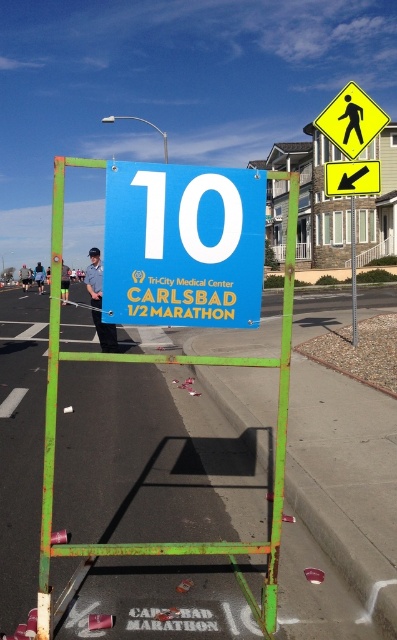
Question: Is smooth asphalt road at center bigger than green metal pole at center?

Choices:
 (A) yes
 (B) no

Answer: (B)

Question: Which object is closer to the camera taking this photo?

Choices:
 (A) smooth asphalt road at center
 (B) yellow plastic pedestrian crossing sign at upper right
 (C) yellow diamond pedestrian sign at upper right

Answer: (A)

Question: Which object appears farthest from the camera in this image?

Choices:
 (A) smooth asphalt road at center
 (B) blue matte sign at center
 (C) yellow diamond pedestrian sign at upper right
 (D) concrete at lower center

Answer: (C)

Question: Is blue matte sign at center above green metal pole at center?

Choices:
 (A) yes
 (B) no

Answer: (B)

Question: Which point is closer to the camera?

Choices:
 (A) concrete at lower center
 (B) yellow plastic pedestrian crossing sign at upper right

Answer: (A)

Question: Can you confirm if blue matte sign at center is smaller than concrete at lower center?

Choices:
 (A) no
 (B) yes

Answer: (A)